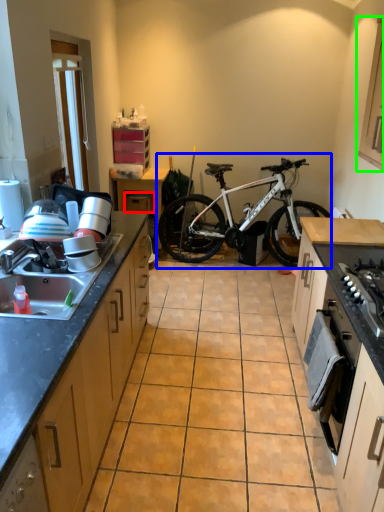
Question: Estimate the real-world distances between objects in this image. Which object is closer to drawer (highlighted by a red box), bicycle (highlighted by a blue box) or cabinetry (highlighted by a green box)?

Choices:
 (A) bicycle
 (B) cabinetry

Answer: (A)